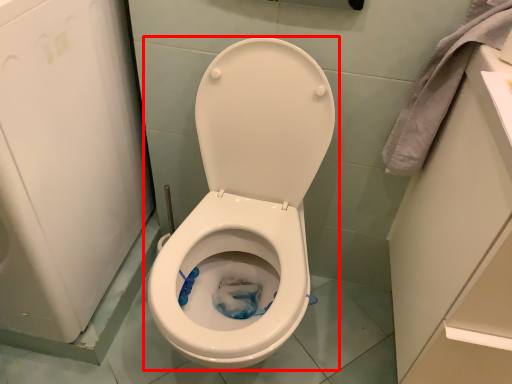
Question: From the image's perspective, what is the correct spatial relationship of toilet (annotated by the red box) in relation to material?

Choices:
 (A) below
 (B) above

Answer: (A)